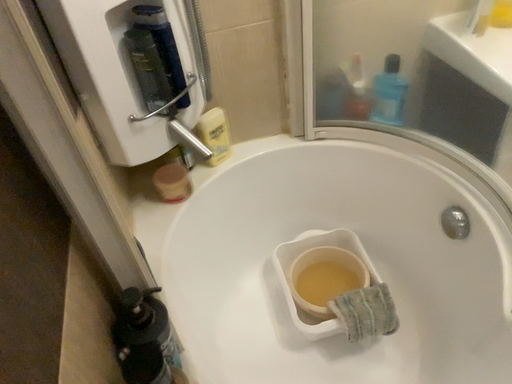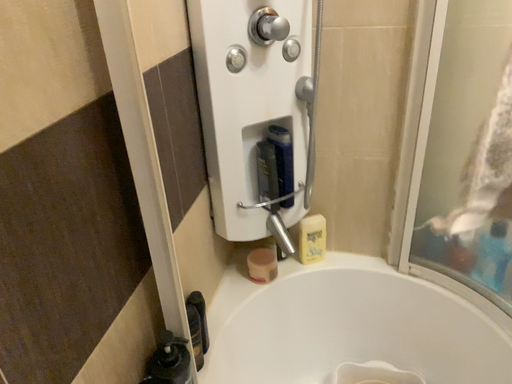
Question: Which way did the camera rotate in the video?

Choices:
 (A) rotated upward
 (B) rotated downward

Answer: (A)